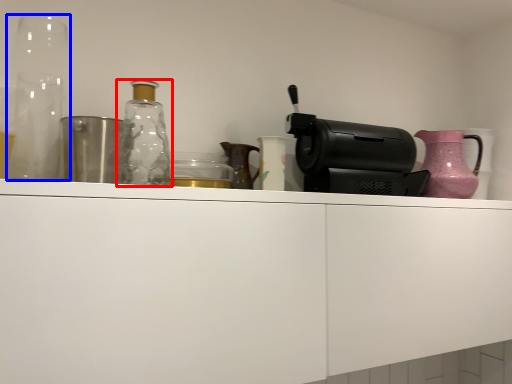
Question: Which object is further to the camera taking this photo, bottle (highlighted by a red box) or glass vase (highlighted by a blue box)?

Choices:
 (A) bottle
 (B) glass vase

Answer: (A)